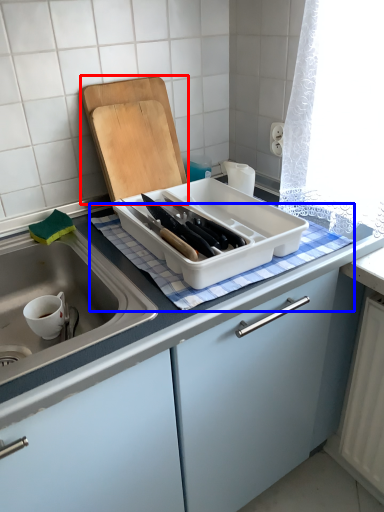
Question: Which of the following is the farthest to the observer, cutting board (highlighted by a red box) or tablecloth (highlighted by a blue box)?

Choices:
 (A) cutting board
 (B) tablecloth

Answer: (A)